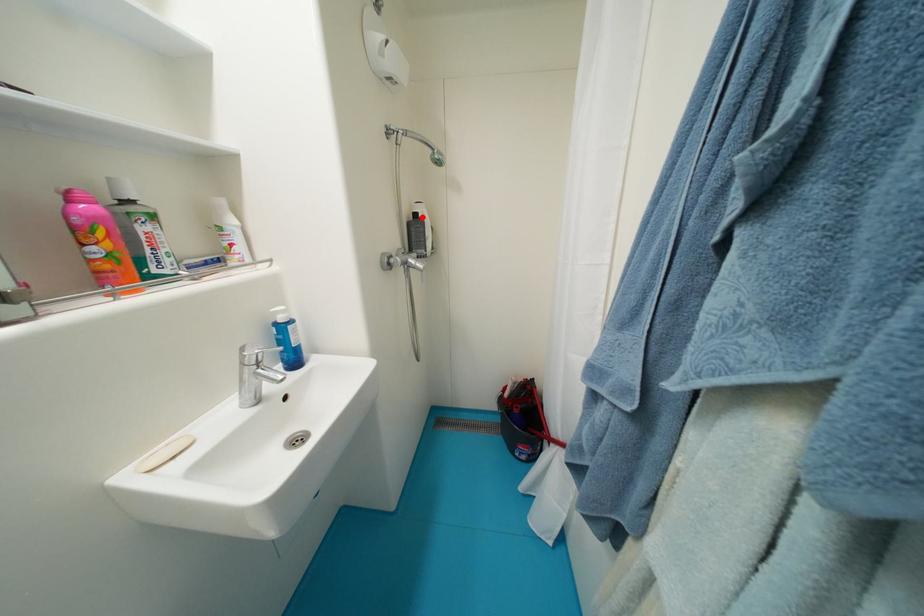
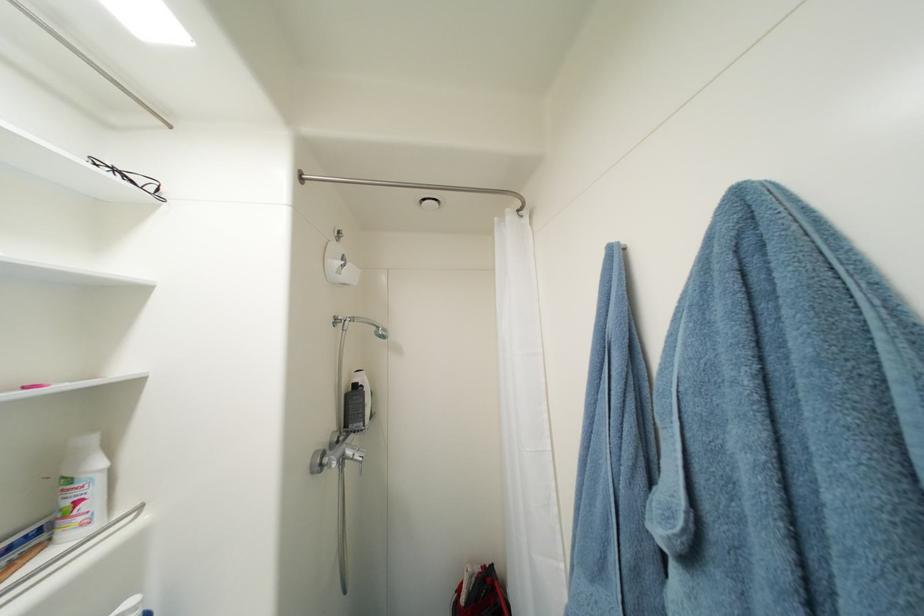
Question: I am providing you with two images of the same scene from different viewpoints. Given a red point in image1, look at the same physical point in image2. Is it:

Choices:
 (A) Closer to the viewpoint
 (B) Farther from the viewpoint

Answer: (B)